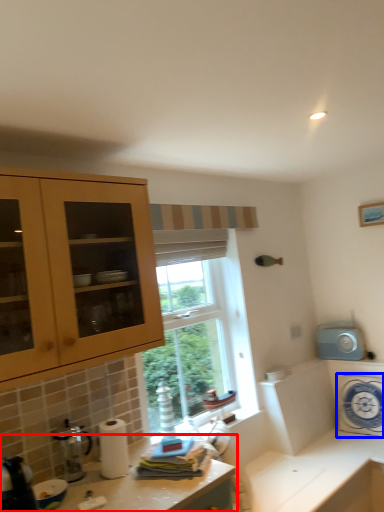
Question: Which point is further to the camera, countertop (highlighted by a red box) or appliance (highlighted by a blue box)?

Choices:
 (A) countertop
 (B) appliance

Answer: (B)